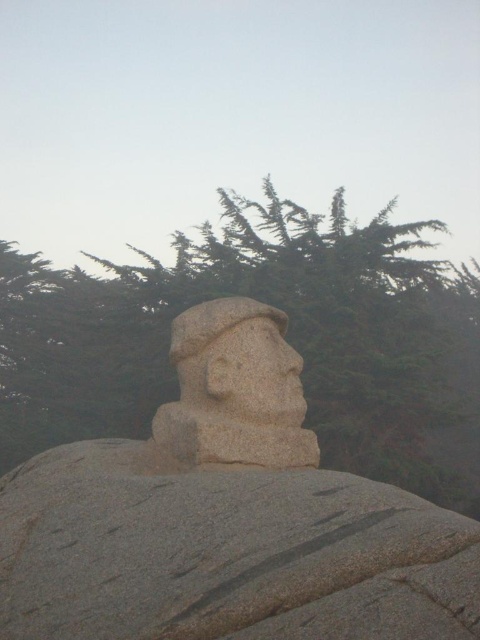
Question: In this image, where is granite statue at center located relative to granite statue head at center?

Choices:
 (A) above
 (B) below

Answer: (B)

Question: Which point is farther to the camera?

Choices:
 (A) (240, 401)
 (B) (279, 348)

Answer: (B)

Question: Among these objects, which one is nearest to the camera?

Choices:
 (A) granite boulder at center
 (B) granite statue at center

Answer: (A)

Question: Is granite boulder at center below granite statue head at center?

Choices:
 (A) yes
 (B) no

Answer: (A)

Question: Does green textured tree at upper center have a smaller size compared to granite statue head at center?

Choices:
 (A) no
 (B) yes

Answer: (A)

Question: Which of the following is the closest to the observer?

Choices:
 (A) green textured tree at upper center
 (B) granite boulder at center
 (C) granite statue at center

Answer: (B)